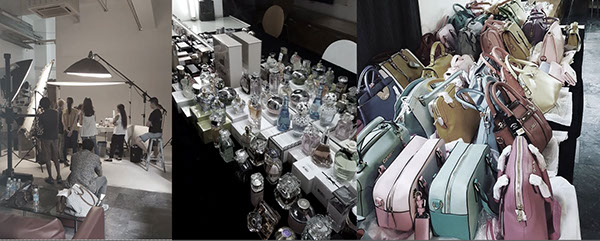
Locate an element on the screen. perfume bottle is located at coordinates (324, 151).